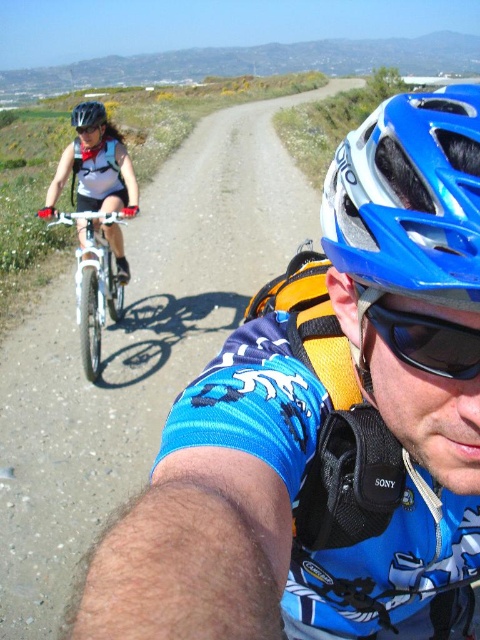
You are a photographer standing at the side of the gravel path. You want to capture a photo that includes both the blue matte bicycle helmet at center and the white matte bicycle at left. Which object should you adjust your camera angle to focus on first to ensure both are in frame?

The blue matte bicycle helmet at center has a smaller width compared to the white matte bicycle at left, so you should focus on the wider white matte bicycle at left first to ensure both fit within the frame.

What object is located at the coordinates point (94, 280)?

The point (94, 280) corresponds to the white matte bicycle at left.

You are a photographer positioned at the starting point of the path. You want to capture a photo that includes both the blue matte bicycle helmet at center and the white matte bicycle at left. Based on their positions, which object should appear closer to the camera in the photo?

The blue matte bicycle helmet at center should appear closer to the camera because it is positioned in front of the white matte bicycle at left in the scene.